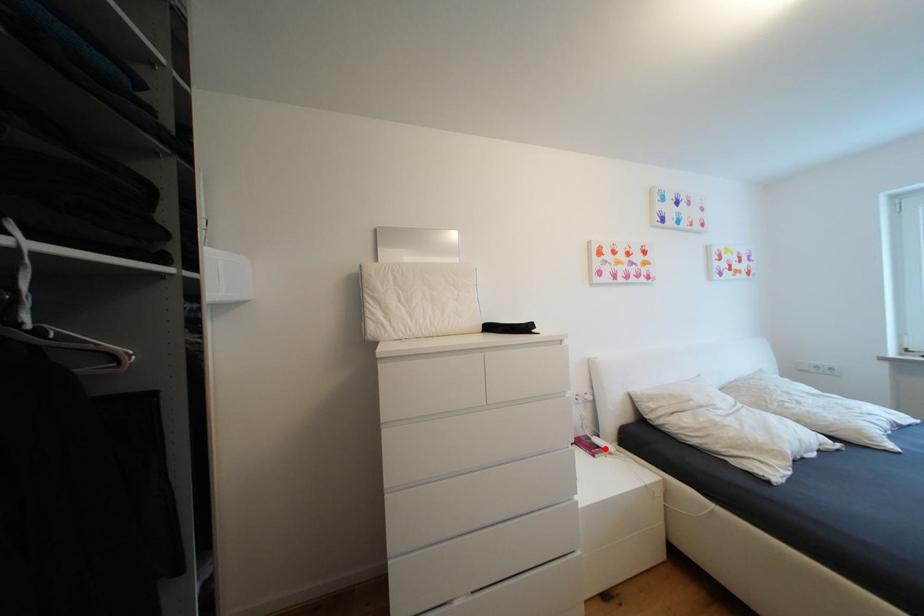
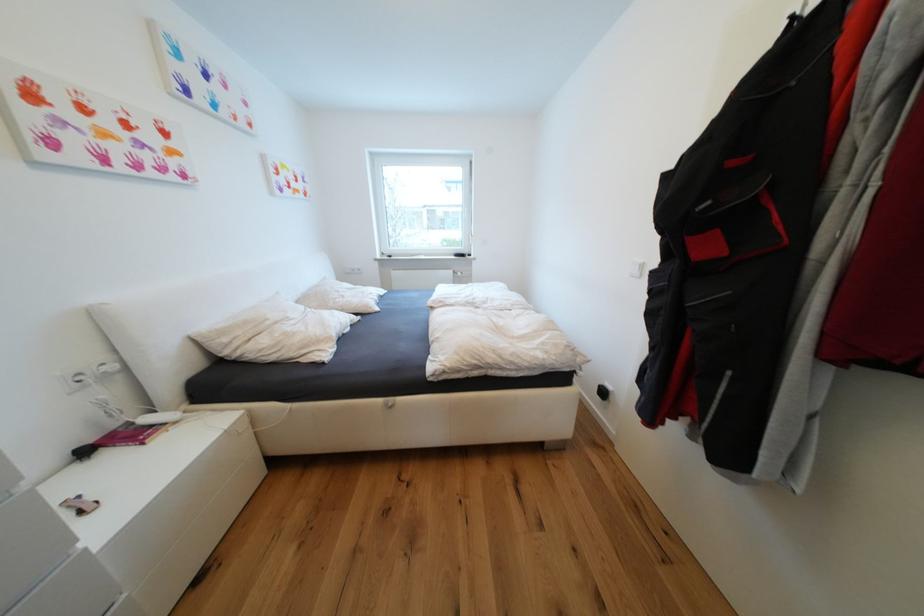
Question: I am providing you with two images of the same scene from different viewpoints. Given a red point in image1, look at the same physical point in image2. Is it:

Choices:
 (A) Closer to the viewpoint
 (B) Farther from the viewpoint

Answer: (A)